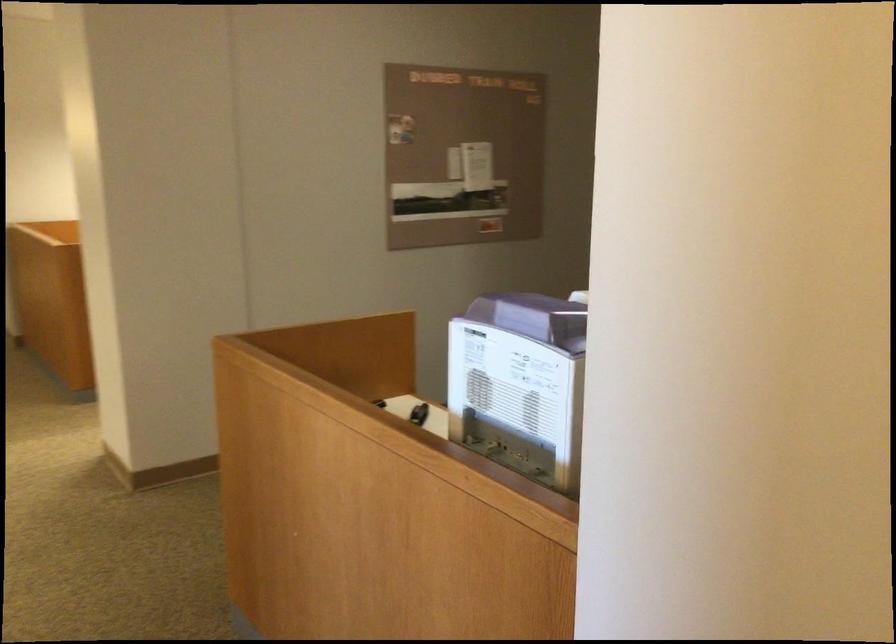
What do you see at coordinates (540, 316) in the screenshot?
I see `the purple machine lid` at bounding box center [540, 316].